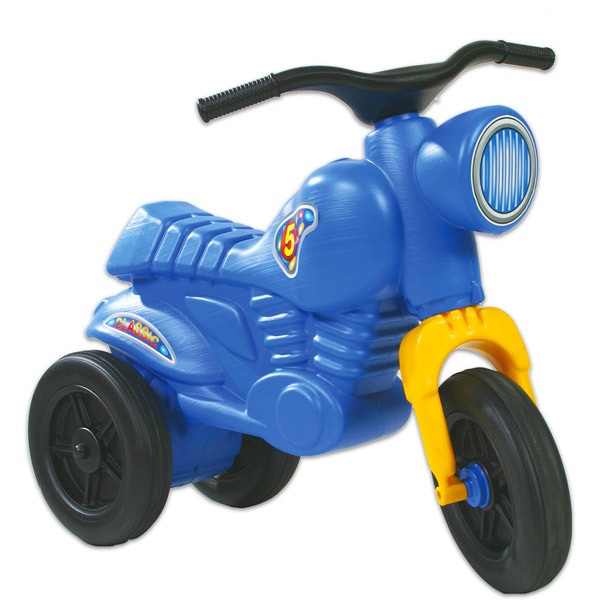
The width and height of the screenshot is (600, 600). Identify the location of cuts in seat. (222, 244), (195, 244), (180, 242), (164, 232).